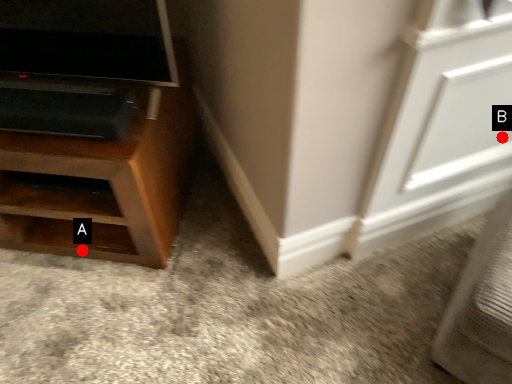
Question: Two points are circled on the image, labeled by A and B beside each circle. Among these points, which one is nearest to the camera?

Choices:
 (A) A is closer
 (B) B is closer

Answer: (B)